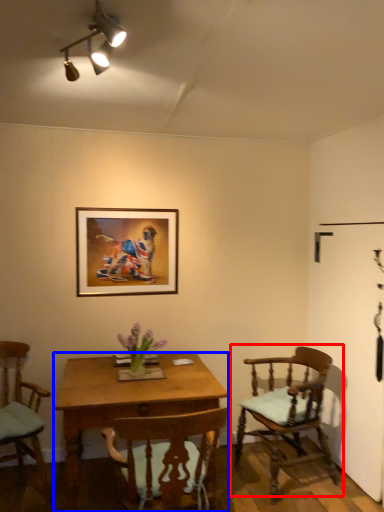
Question: Which point is closer to the camera, chair (highlighted by a red box) or desk (highlighted by a blue box)?

Choices:
 (A) chair
 (B) desk

Answer: (B)